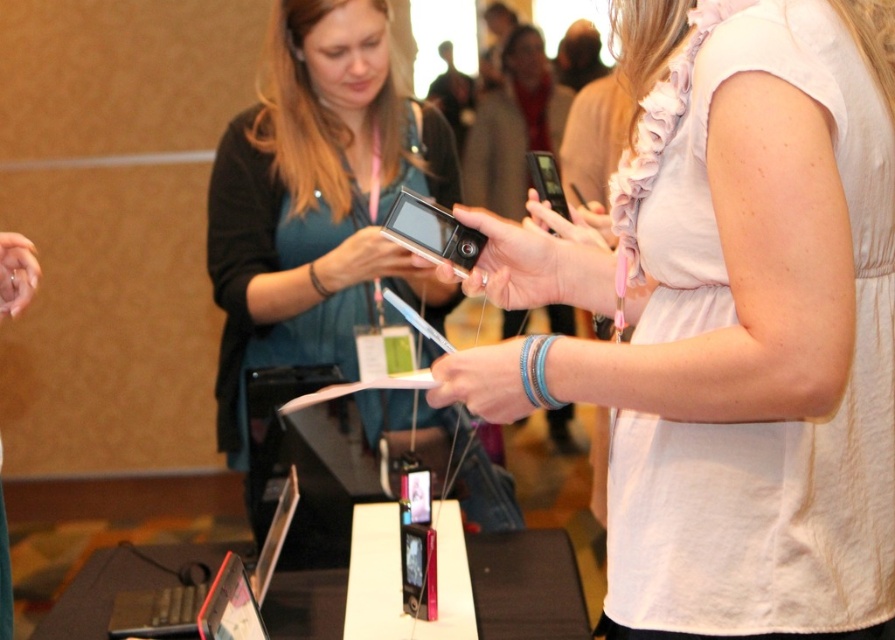
Does matte black camera at center lie in front of black glossy laptop at lower left?

No, it is behind black glossy laptop at lower left.

Who is positioned more to the left, matte black camera at center or black glossy laptop at lower left?

From the viewer's perspective, black glossy laptop at lower left appears more on the left side.

Which is in front, point (263, 301) or point (211, 611)?

Positioned in front is point (211, 611).

The height and width of the screenshot is (640, 895). In order to click on matte black camera at center in this screenshot , I will do `click(317, 202)`.

Does black glossy laptop at lower left have a lesser width compared to matte black tablet at lower left?

No.

Identify the location of black glossy laptop at lower left. The width and height of the screenshot is (895, 640). (210, 592).

Measure the distance between matte black camera at center and camera.

They are 6.78 feet apart.

This screenshot has width=895, height=640. Describe the element at coordinates (317, 202) in the screenshot. I see `matte black camera at center` at that location.

Locate an element on the screen. The height and width of the screenshot is (640, 895). matte black camera at center is located at coordinates (317, 202).